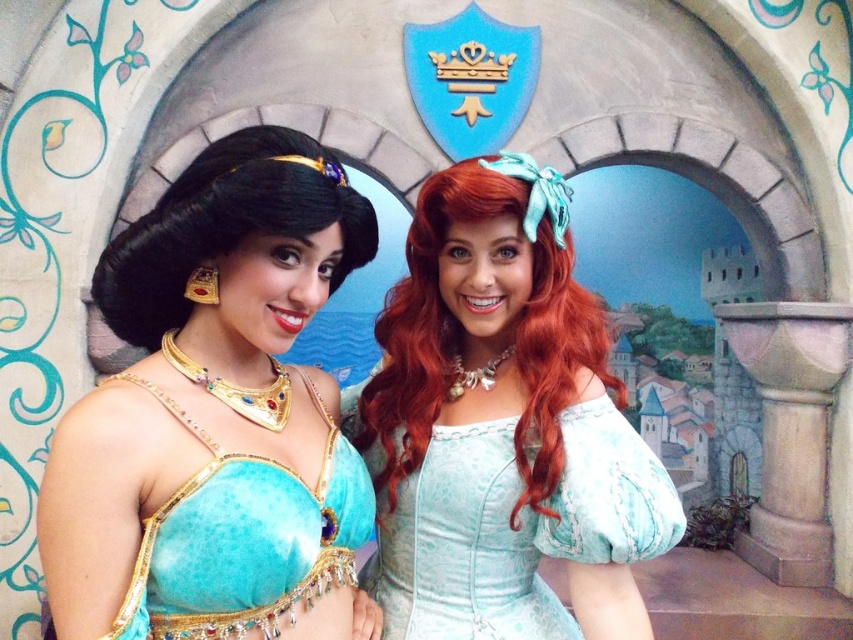
Does point (432, 256) come behind point (334, 449)?

That is True.

Based on the photo, which is more to the left, matte teal dress at center or turquoise velvet top at center?

Positioned to the left is turquoise velvet top at center.

Is point (560, 435) closer to camera compared to point (318, 486)?

That is False.

This screenshot has height=640, width=853. I want to click on matte teal dress at center, so click(x=502, y=433).

The width and height of the screenshot is (853, 640). Describe the element at coordinates (216, 417) in the screenshot. I see `matte blue fabric dress at left` at that location.

Between matte blue fabric dress at left and matte teal dress at center, which one has less height?

matte blue fabric dress at left

Is point (270, 173) less distant than point (369, 566)?

That is True.

The width and height of the screenshot is (853, 640). In order to click on matte blue fabric dress at left in this screenshot , I will do `click(216, 417)`.

Based on the photo, who is more distant from viewer, (115, 529) or (318, 529)?

The point (318, 529) is behind.

Does matte blue fabric dress at left have a lesser width compared to turquoise velvet top at center?

Incorrect, matte blue fabric dress at left's width is not less than turquoise velvet top at center's.

The height and width of the screenshot is (640, 853). I want to click on matte blue fabric dress at left, so click(216, 417).